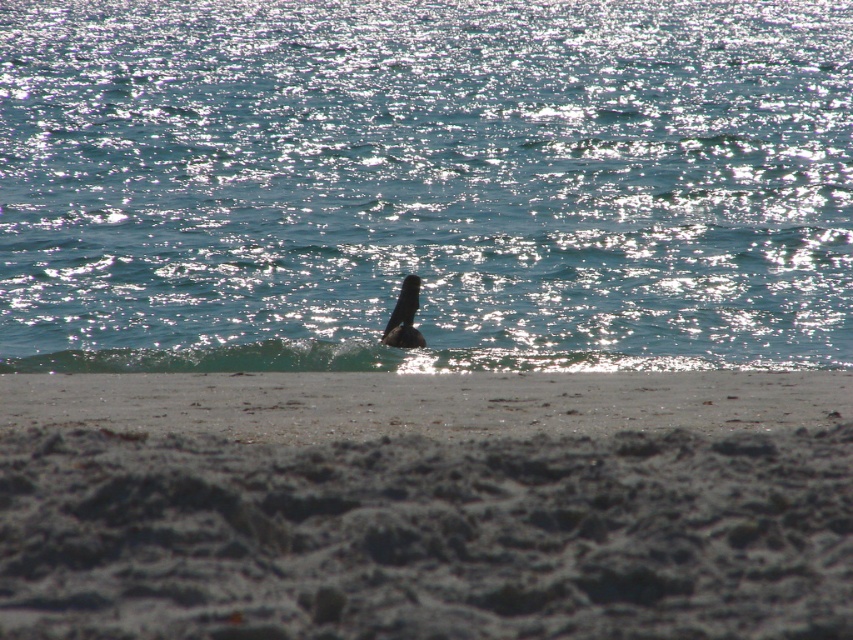
Question: Which point appears farthest from the camera in this image?

Choices:
 (A) (306, 492)
 (B) (402, 285)
 (C) (148, 348)

Answer: (C)

Question: Can you confirm if gray sandy beach at lower center is positioned to the left of dark brown feathers at center?

Choices:
 (A) yes
 (B) no

Answer: (B)

Question: Which of these objects is positioned closest to the shiny blue water at center?

Choices:
 (A) gray sandy beach at lower center
 (B) smooth sand at lower center

Answer: (A)

Question: Does shiny blue water at center appear on the left side of gray sandy beach at lower center?

Choices:
 (A) no
 (B) yes

Answer: (B)

Question: Considering the relative positions of shiny blue water at center and dark brown feathers at center in the image provided, where is shiny blue water at center located with respect to dark brown feathers at center?

Choices:
 (A) left
 (B) right

Answer: (A)

Question: Which of the following is the farthest from the observer?

Choices:
 (A) (674, 372)
 (B) (409, 298)
 (C) (114, 634)

Answer: (B)